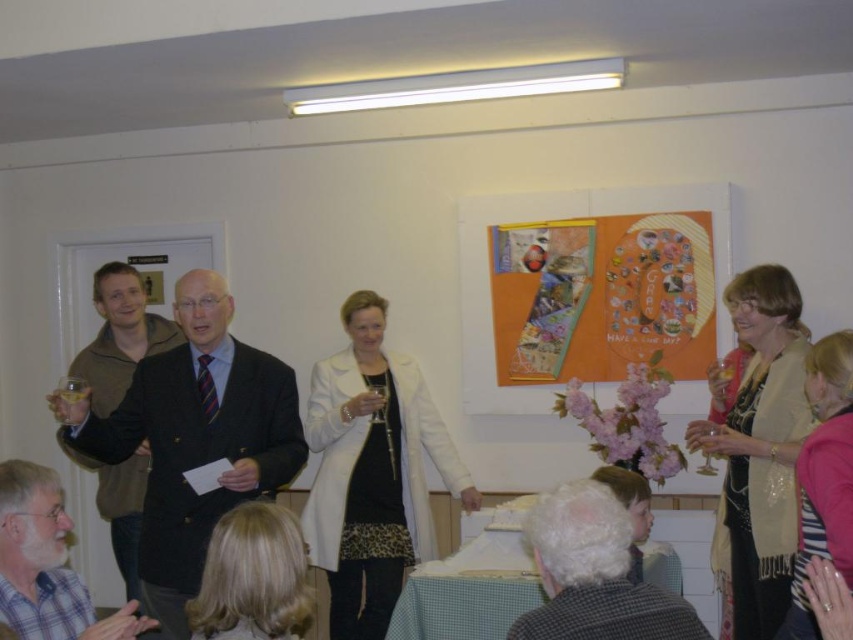
Is point (419, 508) more distant than point (851, 442)?

Yes, point (419, 508) is farther from viewer.

Between point (407, 394) and point (843, 358), which one is positioned behind?

Point (407, 394)

This screenshot has width=853, height=640. Identify the location of white matte coat at center. (372, 472).

Locate an element on the screen. Image resolution: width=853 pixels, height=640 pixels. blonde hair at lower center is located at coordinates (253, 577).

Which is in front, point (264, 516) or point (811, 385)?

Point (264, 516) is more forward.

Locate an element on the screen. This screenshot has width=853, height=640. blonde hair at lower center is located at coordinates (253, 577).

Who is lower down, beige textured scarf at right or gray wool sweater at lower center?

gray wool sweater at lower center

Can you confirm if beige textured scarf at right is positioned to the left of gray wool sweater at lower center?

No, beige textured scarf at right is not to the left of gray wool sweater at lower center.

Describe the element at coordinates (758, 449) in the screenshot. The width and height of the screenshot is (853, 640). I see `beige textured scarf at right` at that location.

Where is `beige textured scarf at right`? The image size is (853, 640). beige textured scarf at right is located at coordinates (758, 449).